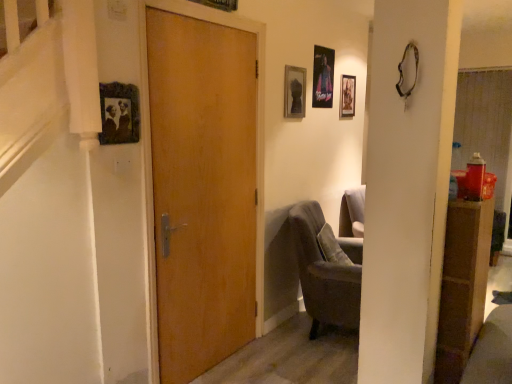
Question: Which direction should I rotate to face wooden picture frame at upper center, marked as the fourth picture frame in a back-to-front arrangement, — up or down?

Choices:
 (A) down
 (B) up

Answer: (B)

Question: Is matte black picture frame at upper left, marked as the 1th picture frame in a left-to-right arrangement, looking in the opposite direction of matte black picture frame at upper center, the fifth picture frame in the left-to-right sequence?

Choices:
 (A) no
 (B) yes

Answer: (A)

Question: From the image's perspective, is matte black picture frame at upper left, marked as the 1th picture frame in a left-to-right arrangement, on top of matte black picture frame at upper center, the 5th picture frame from the front?

Choices:
 (A) yes
 (B) no

Answer: (B)

Question: Is matte black picture frame at upper left, arranged as the 5th picture frame when viewed from the back, not inside matte black picture frame at upper center, the fifth picture frame in the left-to-right sequence?

Choices:
 (A) no
 (B) yes

Answer: (B)

Question: From a real-world perspective, is matte black picture frame at upper left, the 5th picture frame in the right-to-left sequence, positioned under matte black picture frame at upper center, the fifth picture frame in the left-to-right sequence, based on gravity?

Choices:
 (A) no
 (B) yes

Answer: (B)

Question: Is matte black picture frame at upper left, the 5th picture frame in the right-to-left sequence, behind matte black picture frame at upper center, which is the first picture frame from back to front?

Choices:
 (A) no
 (B) yes

Answer: (A)

Question: Is matte black picture frame at upper left, arranged as the 1th picture frame when viewed from the front, directly adjacent to matte black picture frame at upper center, marked as the 1th picture frame in a right-to-left arrangement?

Choices:
 (A) yes
 (B) no

Answer: (B)

Question: Considering the relative positions of matte black picture frame at upper center, the 5th picture frame from the front, and metallic poster at upper center, which is the second picture frame in back-to-front order, in the image provided, is matte black picture frame at upper center, the 5th picture frame from the front, in front of metallic poster at upper center, which is the second picture frame in back-to-front order,?

Choices:
 (A) yes
 (B) no

Answer: (B)

Question: Is matte black picture frame at upper center, the 5th picture frame from the front, smaller than metallic poster at upper center, which is the 2th picture frame from right to left?

Choices:
 (A) no
 (B) yes

Answer: (B)

Question: From the image's perspective, is matte black picture frame at upper center, the 5th picture frame from the front, above metallic poster at upper center, which is the second picture frame in back-to-front order?

Choices:
 (A) no
 (B) yes

Answer: (A)

Question: Does matte black picture frame at upper center, the fifth picture frame in the left-to-right sequence, appear on the right side of metallic poster at upper center, which is the second picture frame in back-to-front order?

Choices:
 (A) no
 (B) yes

Answer: (B)

Question: Can you confirm if matte black picture frame at upper center, which is the first picture frame from back to front, is positioned to the left of metallic poster at upper center, which appears as the 4th picture frame when viewed from the left?

Choices:
 (A) no
 (B) yes

Answer: (A)

Question: Is matte black picture frame at upper center, the fifth picture frame in the left-to-right sequence, turned away from metallic poster at upper center, acting as the fourth picture frame starting from the front?

Choices:
 (A) yes
 (B) no

Answer: (B)

Question: Can you confirm if matte glass picture frame at upper center, which appears as the 3th picture frame when viewed from the back, is taller than matte black picture frame at upper left, marked as the 1th picture frame in a left-to-right arrangement?

Choices:
 (A) yes
 (B) no

Answer: (A)